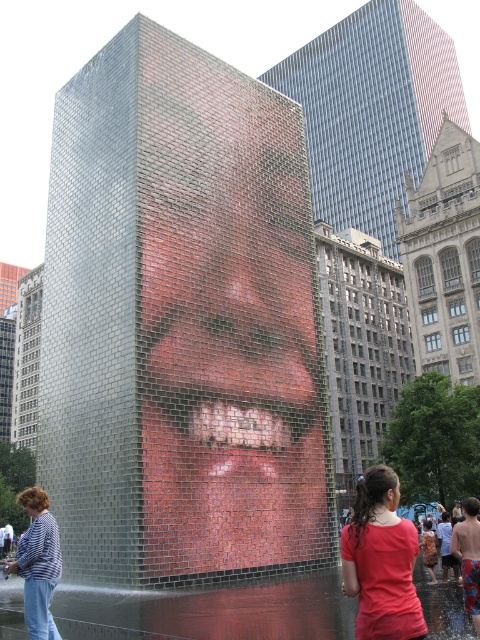
You are standing in the urban scene described. You need to locate the matte red shirt at lower right. According to the coordinates provided, where exactly should you look to find it?

The matte red shirt at lower right is located at point (x=381, y=561).

You are a photographer standing at the edge of the shallow pool in front of the glass cube. You want to take a photo that includes both the striped fabric shirt at lower left and the orange printed dress at lower center. Given that your camera has a maximum focus range of 20 meters, will you be able to capture both subjects in sharp focus without moving your position?

The distance between the striped fabric shirt at lower left and the orange printed dress at lower center is 18.39 meters, which is within the camera maximum focus range of 20 meters. Therefore, you can capture both subjects in sharp focus without moving.